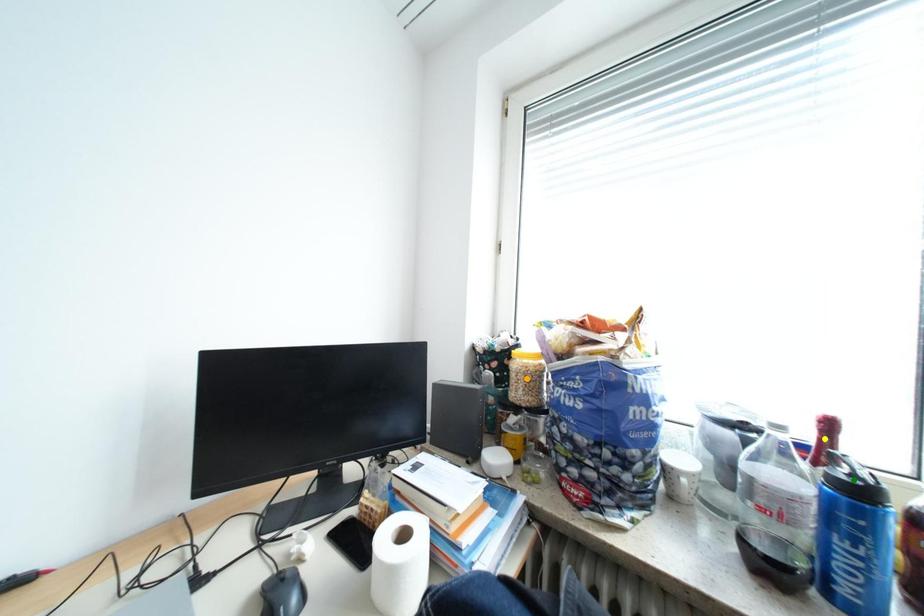
Order these from nearest to farthest:
green point
orange point
yellow point

green point < yellow point < orange point